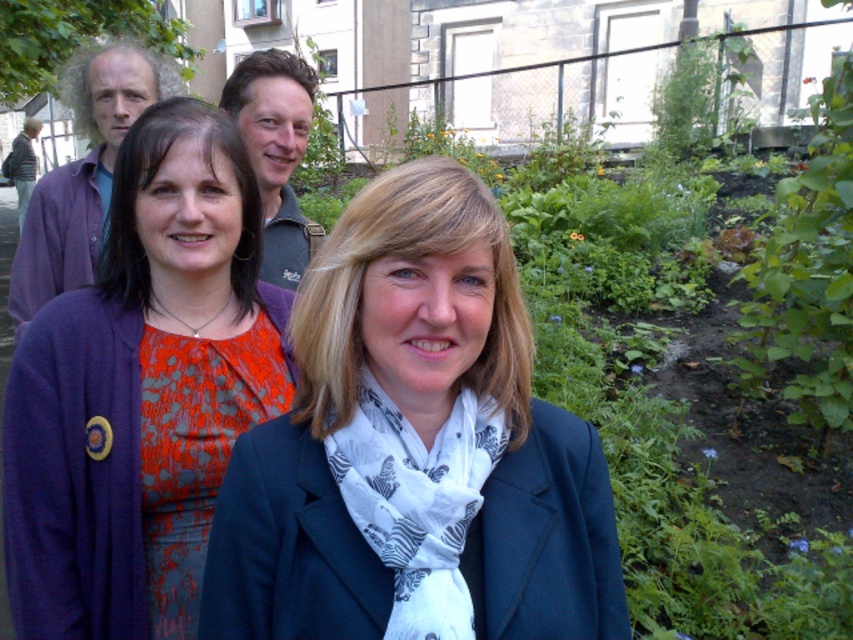
Question: Which object is farther from the camera taking this photo?

Choices:
 (A) matte purple shirt at upper left
 (B) matte purple cardigan at center
 (C) matte black blazer at center
 (D) green textured shirt at center

Answer: (A)

Question: Which is nearer to the green textured shirt at center?

Choices:
 (A) matte black blazer at center
 (B) matte purple shirt at upper left
 (C) matte purple cardigan at center

Answer: (C)

Question: Is matte black blazer at center positioned at the back of matte purple cardigan at center?

Choices:
 (A) no
 (B) yes

Answer: (A)

Question: Is matte black blazer at center closer to camera compared to matte purple cardigan at center?

Choices:
 (A) yes
 (B) no

Answer: (A)

Question: Which object is positioned farthest from the matte purple cardigan at center?

Choices:
 (A) matte black blazer at center
 (B) matte purple shirt at upper left

Answer: (B)

Question: Is matte black blazer at center above matte purple cardigan at center?

Choices:
 (A) yes
 (B) no

Answer: (B)